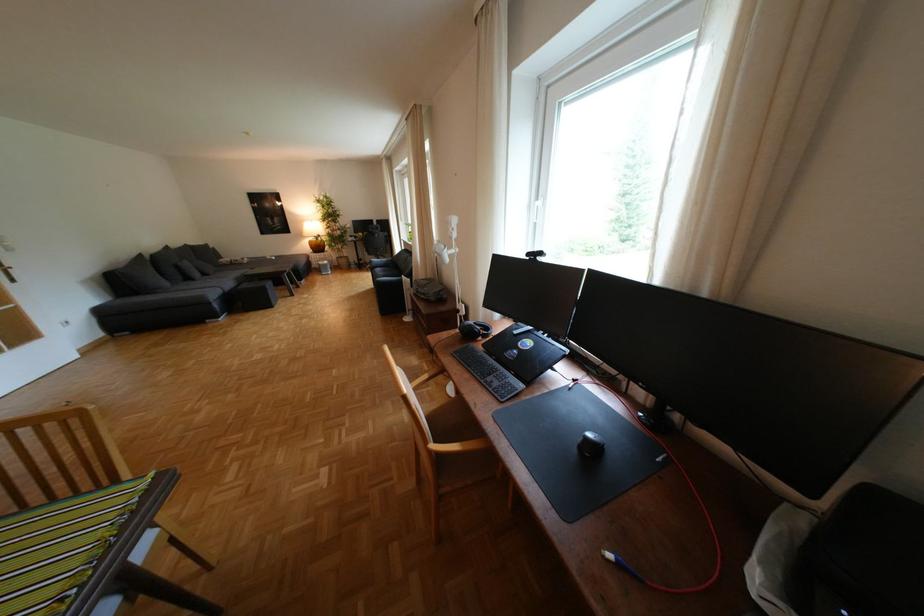
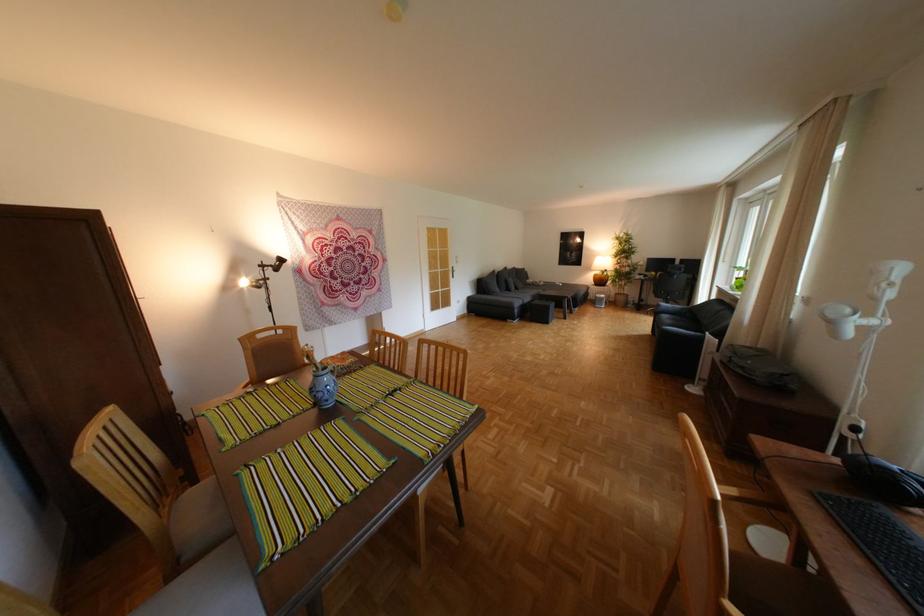
Where in the second image is the point corresponding to (x=333, y=216) from the first image?

(626, 252)